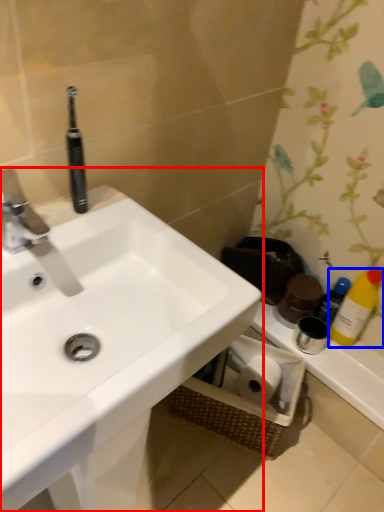
Question: Which object is further to the camera taking this photo, sink (highlighted by a red box) or cleaning product (highlighted by a blue box)?

Choices:
 (A) sink
 (B) cleaning product

Answer: (B)